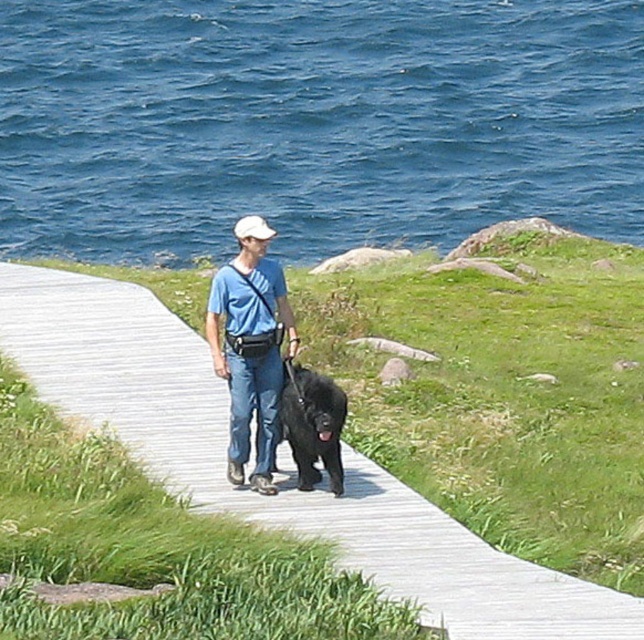
You are a drone operator trying to capture a photo of the man and his large black dog on the boardwalk. You need to position your drone so that it is directly above the blue water at upper center. What are the coordinates where you should place the drone?

The coordinates for the blue water at upper center are at point [314,122]. Therefore, you should position the drone directly above the blue water at upper center at those coordinates.

You are a photographer standing on the wooden boardwalk at center. You want to take a photo of the matte blue shirt at center. Which direction should you look to capture the shirt in your shot?

The wooden boardwalk at center is below matte blue shirt at center, so you should look upward to capture the matte blue shirt at center in your shot.